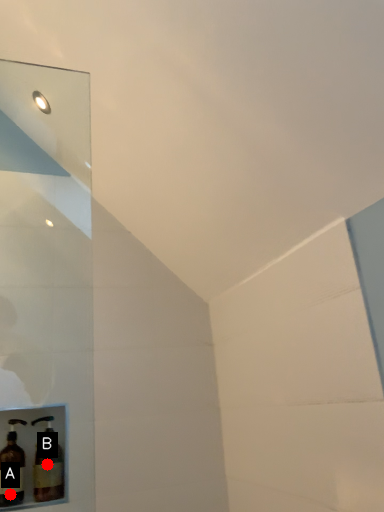
Question: Two points are circled on the image, labeled by A and B beside each circle. Which point is closer to the camera taking this photo?

Choices:
 (A) A is closer
 (B) B is closer

Answer: (A)